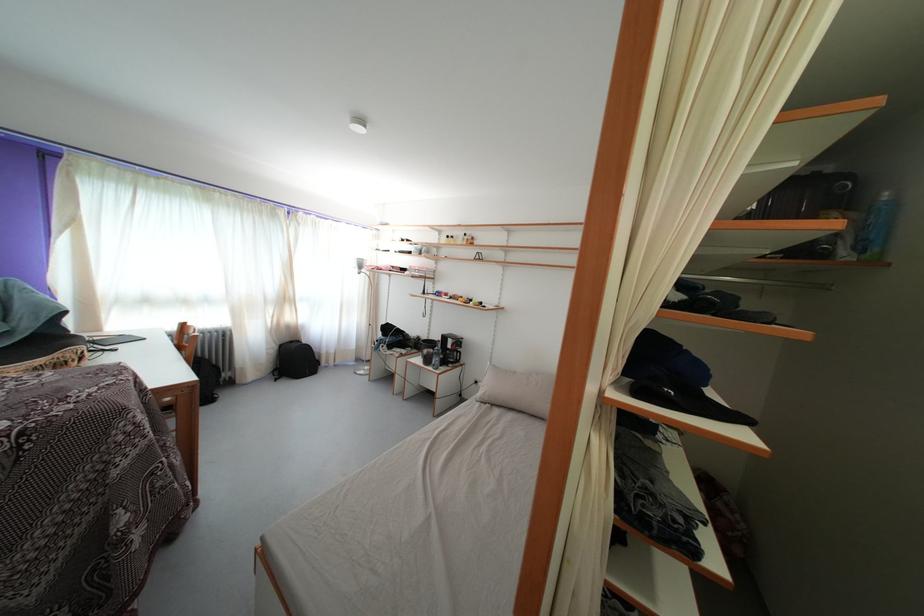
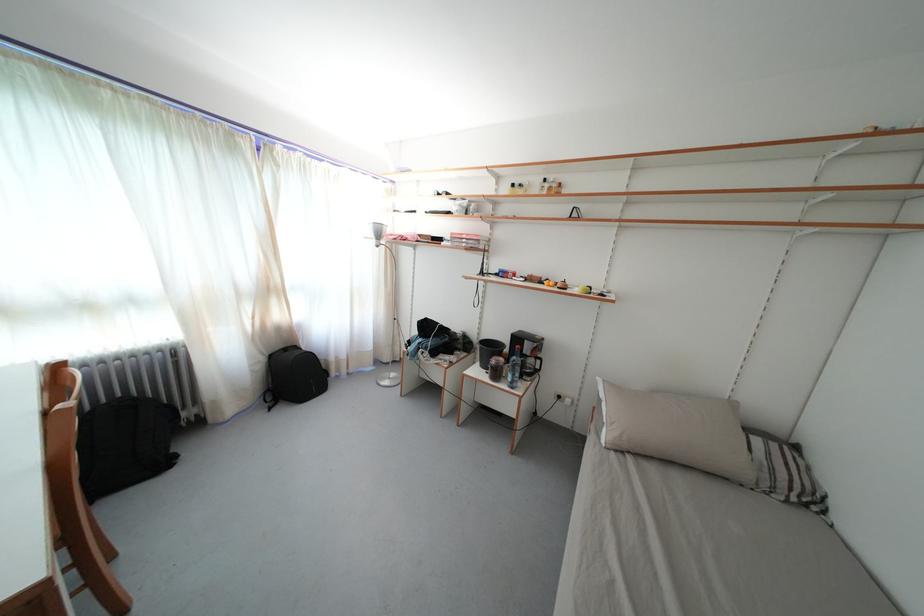
Find the pixel in the second image that matches [454,243] in the first image.

(518, 191)